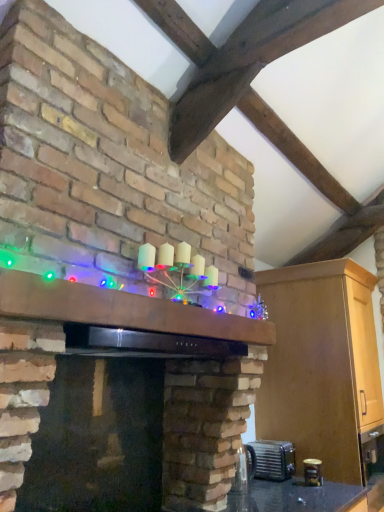
Question: Is metallic silver toaster at lower right, which is the 1th appliance in right-to-left order, spatially inside metallic silver toaster at lower right, the second appliance in the right-to-left sequence, or outside of it?

Choices:
 (A) outside
 (B) inside

Answer: (A)

Question: Considering the positions of metallic silver toaster at lower right, which appears as the 2th appliance when viewed from the front, and metallic silver toaster at lower right, which is counted as the 1th appliance, starting from the front, in the image, is metallic silver toaster at lower right, which appears as the 2th appliance when viewed from the front, wider or thinner than metallic silver toaster at lower right, which is counted as the 1th appliance, starting from the front,?

Choices:
 (A) thin
 (B) wide

Answer: (B)

Question: Considering the real-world distances, which object is farthest from the matte black exhaust hood at upper center?

Choices:
 (A) illuminated wooden mantle at center
 (B) matte brick fireplace at center
 (C) metallic silver toaster at lower right, placed as the second appliance when sorted from back to front
 (D) metallic silver toaster at lower right, the 2th appliance viewed from the left

Answer: (C)

Question: Which object is positioned closest to the metallic silver toaster at lower right, placed as the 1th appliance when sorted from back to front?

Choices:
 (A) matte black exhaust hood at upper center
 (B) illuminated wooden mantle at center
 (C) matte brick fireplace at center
 (D) metallic silver toaster at lower right, placed as the second appliance when sorted from back to front

Answer: (D)